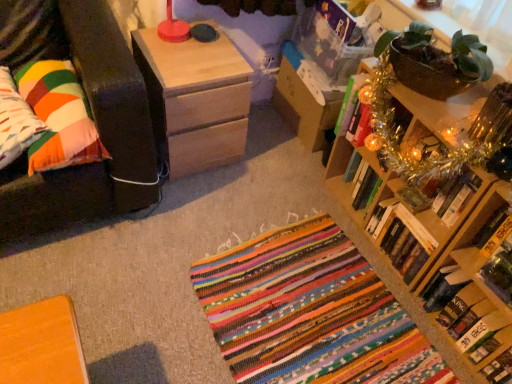
Question: Can you confirm if multicolored fabric pillow at left, the 1th pillow when ordered from left to right, is shorter than hardcover book at lower right, arranged as the 5th book when viewed from the top?

Choices:
 (A) no
 (B) yes

Answer: (B)

Question: From a real-world perspective, does multicolored fabric pillow at left, marked as the 2th pillow in a right-to-left arrangement, sit lower than hardcover book at lower right, arranged as the 5th book when viewed from the top?

Choices:
 (A) no
 (B) yes

Answer: (A)

Question: Is multicolored fabric pillow at left, the 1th pillow when ordered from left to right, located outside hardcover book at lower right, marked as the 1th book in a bottom-to-top arrangement?

Choices:
 (A) no
 (B) yes

Answer: (B)

Question: Is multicolored fabric pillow at left, the 1th pillow when ordered from left to right, with hardcover book at lower right, marked as the 1th book in a bottom-to-top arrangement?

Choices:
 (A) no
 (B) yes

Answer: (A)

Question: Is multicolored fabric pillow at left, the 1th pillow when ordered from left to right, at the right side of hardcover book at lower right, arranged as the 5th book when viewed from the top?

Choices:
 (A) no
 (B) yes

Answer: (A)

Question: Does multicolored fabric pillow at left, the 1th pillow when ordered from left to right, have a smaller size compared to hardcover book at lower right, arranged as the 5th book when viewed from the top?

Choices:
 (A) no
 (B) yes

Answer: (A)

Question: Does multicolored fabric pillow at left, the 1th pillow when ordered from left to right, have a lesser width compared to hardcover book at center right, the third book when ordered from bottom to top?

Choices:
 (A) no
 (B) yes

Answer: (B)

Question: Is multicolored fabric pillow at left, the 1th pillow when ordered from left to right, located outside hardcover book at center right, which is the third book in top-to-bottom order?

Choices:
 (A) no
 (B) yes

Answer: (B)

Question: Is multicolored fabric pillow at left, the 1th pillow when ordered from left to right, closer to the viewer compared to hardcover book at center right, the third book when ordered from bottom to top?

Choices:
 (A) no
 (B) yes

Answer: (B)

Question: From a real-world perspective, is multicolored fabric pillow at left, marked as the 2th pillow in a right-to-left arrangement, physically below hardcover book at center right, which is the third book in top-to-bottom order?

Choices:
 (A) no
 (B) yes

Answer: (A)

Question: From a real-world perspective, is multicolored fabric pillow at left, marked as the 2th pillow in a right-to-left arrangement, physically above hardcover book at center right, the third book when ordered from bottom to top?

Choices:
 (A) yes
 (B) no

Answer: (A)

Question: Can you confirm if multicolored fabric pillow at left, the 1th pillow when ordered from left to right, is wider than hardcover book at center right, which is the third book in top-to-bottom order?

Choices:
 (A) yes
 (B) no

Answer: (B)

Question: From a real-world perspective, is multicolored fabric pillow at left, marked as the 2th pillow in a right-to-left arrangement, positioned over hardcover book at lower right, marked as the fourth book in a top-to-bottom arrangement, based on gravity?

Choices:
 (A) no
 (B) yes

Answer: (B)